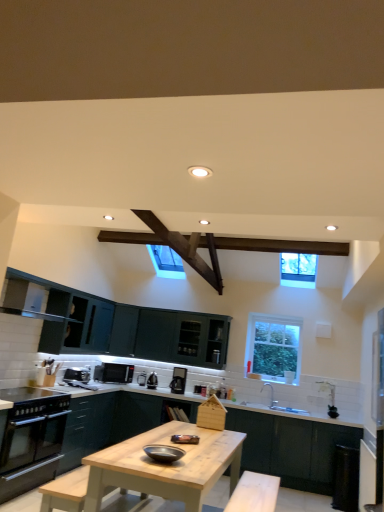
Question: Is matte dark green cabinet at center, acting as the first cabinetry starting from the left, at the left side of black plastic toaster at lower left, the fifth appliance in the right-to-left sequence?

Choices:
 (A) yes
 (B) no

Answer: (B)

Question: Is matte dark green cabinet at center, acting as the first cabinetry starting from the left, positioned with its back to black plastic toaster at lower left, the fifth appliance in the right-to-left sequence?

Choices:
 (A) yes
 (B) no

Answer: (B)

Question: From a real-world perspective, is matte dark green cabinet at center, arranged as the second cabinetry when viewed from the right, positioned over black plastic toaster at lower left, the fifth appliance in the right-to-left sequence, based on gravity?

Choices:
 (A) no
 (B) yes

Answer: (A)

Question: Can you confirm if matte dark green cabinet at center, acting as the first cabinetry starting from the left, is thinner than black plastic toaster at lower left, the 1th appliance from the left?

Choices:
 (A) yes
 (B) no

Answer: (B)

Question: Are matte dark green cabinet at center, arranged as the second cabinetry when viewed from the right, and black plastic toaster at lower left, the fifth appliance in the right-to-left sequence, located far from each other?

Choices:
 (A) yes
 (B) no

Answer: (B)

Question: Relative to clear glass window at upper right, the first window when ordered from bottom to top, is dark green matte cabinet at lower center, which is counted as the 1th cabinetry, starting from the right, in front or behind?

Choices:
 (A) behind
 (B) front

Answer: (B)

Question: Would you say dark green matte cabinet at lower center, which is counted as the 1th cabinetry, starting from the right, is inside or outside clear glass window at upper right, which is the 1th window in back-to-front order?

Choices:
 (A) inside
 (B) outside

Answer: (B)

Question: Would you say dark green matte cabinet at lower center, positioned as the second cabinetry in left-to-right order, is to the left or to the right of clear glass window at upper right, the first window when ordered from bottom to top, in the picture?

Choices:
 (A) left
 (B) right

Answer: (A)

Question: From a real-world perspective, is dark green matte cabinet at lower center, positioned as the second cabinetry in left-to-right order, positioned above or below clear glass window at upper right, marked as the second window in a top-to-bottom arrangement?

Choices:
 (A) above
 (B) below

Answer: (B)

Question: Considering the relative positions of black glass oven at lower left and matte black microwave at center, the second appliance when ordered from left to right, in the image provided, is black glass oven at lower left to the left or to the right of matte black microwave at center, the second appliance when ordered from left to right,?

Choices:
 (A) right
 (B) left

Answer: (B)

Question: Is black glass oven at lower left in front of or behind matte black microwave at center, positioned as the 4th appliance in front-to-back order, in the image?

Choices:
 (A) front
 (B) behind

Answer: (A)

Question: Considering the positions of black glass oven at lower left and matte black microwave at center, which is the 4th appliance in right-to-left order, in the image, is black glass oven at lower left wider or thinner than matte black microwave at center, which is the 4th appliance in right-to-left order,?

Choices:
 (A) thin
 (B) wide

Answer: (B)

Question: From the image's perspective, relative to matte black microwave at center, the second appliance from the back, is black glass oven at lower left above or below?

Choices:
 (A) above
 (B) below

Answer: (B)

Question: From the image's perspective, relative to clear glass window at upper right, marked as the second window in a top-to-bottom arrangement, is matte dark green cabinet at center, arranged as the second cabinetry when viewed from the right, above or below?

Choices:
 (A) above
 (B) below

Answer: (B)

Question: Is matte dark green cabinet at center, acting as the first cabinetry starting from the left, to the left or to the right of clear glass window at upper right, marked as the second window in a top-to-bottom arrangement, in the image?

Choices:
 (A) left
 (B) right

Answer: (A)